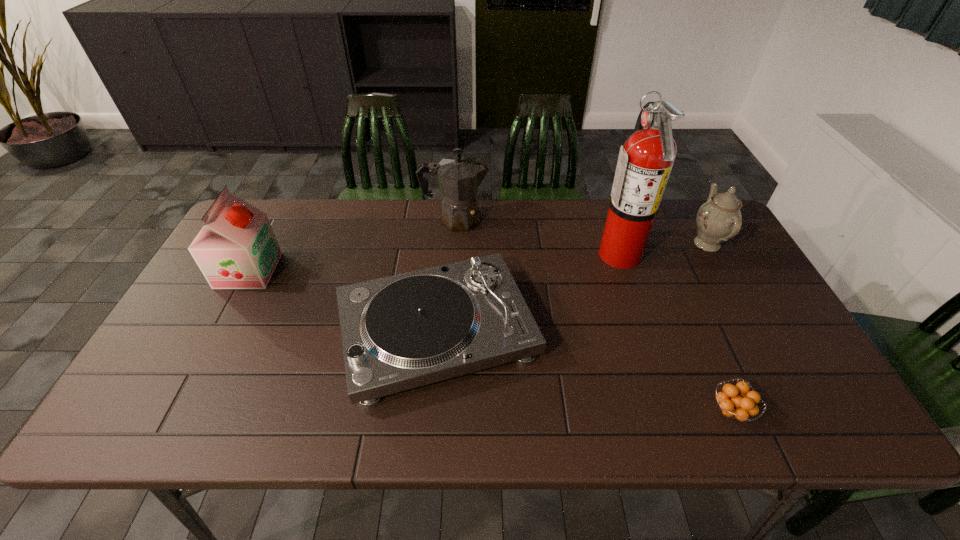
In the image, there is a desktop. Where is `free region at the right edge`? The image size is (960, 540). free region at the right edge is located at coordinates (765, 394).

Locate an element on the screen. unoccupied position between the coffeepot and the fifth object from left to right is located at coordinates (593, 315).

You are a GUI agent. You are given a task and a screenshot of the screen. Output one action in this format:
    pyautogui.click(x=<x>, y=<y>)
    Task: Click on the free area in between the fire extinguisher and the fourth tallest object
    
    Given the screenshot: What is the action you would take?
    pyautogui.click(x=663, y=248)

Where is `vacant region between the fourth object from left to right and the coffeepot`? vacant region between the fourth object from left to right and the coffeepot is located at coordinates (538, 237).

This screenshot has height=540, width=960. Identify the location of free space that is in between the orange fruit and the rightmost object. (719, 327).

Locate an element on the screen. Image resolution: width=960 pixels, height=540 pixels. free space between the orange fruit and the fire extinguisher is located at coordinates (675, 332).

Find the location of `object that can be found as the second closest to the coffeepot`. object that can be found as the second closest to the coffeepot is located at coordinates (644, 165).

Find the location of a particular element. Image resolution: width=960 pixels, height=540 pixels. object that stands as the fourth closest to the coffeepot is located at coordinates (719, 219).

You are a GUI agent. You are given a task and a screenshot of the screen. Output one action in this format:
    pyautogui.click(x=<x>, y=<y>)
    Task: Click on the free space that satisfies the following two spatial constraints: 1. on the nozzle side of the orange fruit; 2. on the left side of the fire extinguisher
    
    Given the screenshot: What is the action you would take?
    pyautogui.click(x=672, y=411)

You are a GUI agent. You are given a task and a screenshot of the screen. Output one action in this format:
    pyautogui.click(x=<x>, y=<y>)
    Task: Click on the free space that satisfies the following two spatial constraints: 1. on the pouring side of the coffeepot; 2. on the back side of the shortest object
    
    Given the screenshot: What is the action you would take?
    pyautogui.click(x=444, y=411)